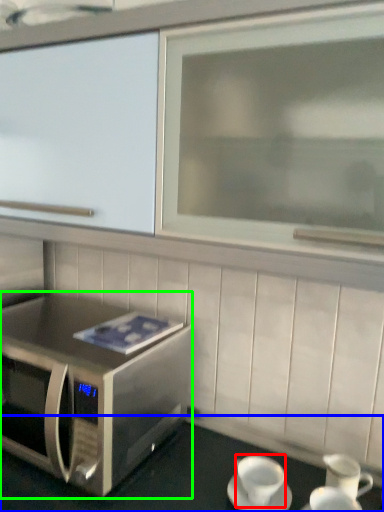
Question: Considering the real-world distances, which object is closest to coffee cup (highlighted by a red box)? table (highlighted by a blue box) or microwave oven (highlighted by a green box).

Choices:
 (A) table
 (B) microwave oven

Answer: (A)